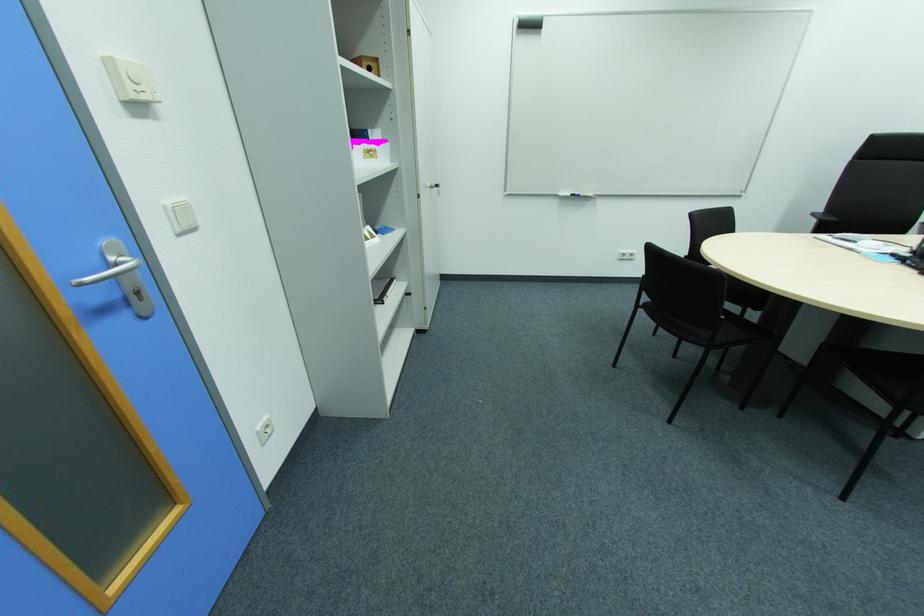
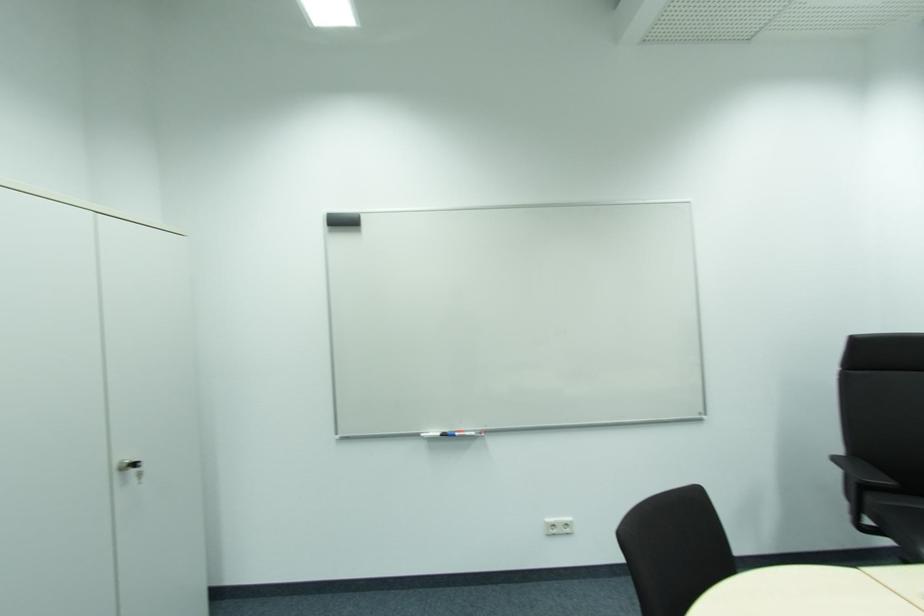
In a continuous first-person perspective shot, in which direction is the camera moving?

The cameraman moved toward right, forward.